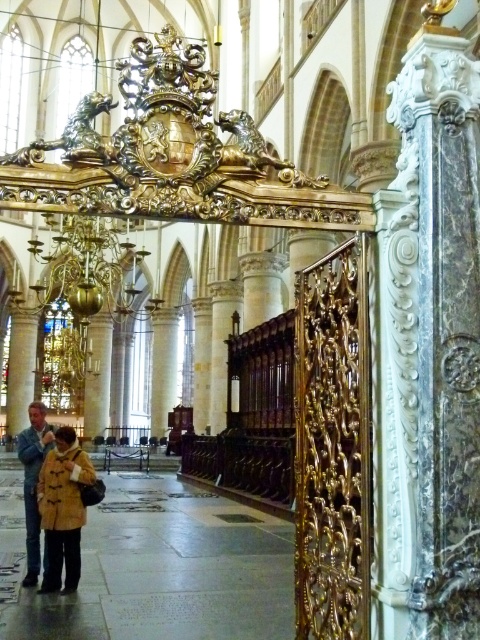
You are standing in the cathedral and need to store your belongings. There is a brown fuzzy coat at lower left and a brown leather jacket at lower left. Which item takes up more space?

The brown leather jacket at lower left takes up more space than the brown fuzzy coat at lower left because the brown fuzzy coat at lower left occupies less space than brown leather jacket at lower left.

You are a visitor entering the cathedral and notice two items at the lower left corner. Which one is shorter between the brown fuzzy coat at lower left and the brown leather jacket at lower left?

The brown fuzzy coat at lower left is shorter than the brown leather jacket at lower left.